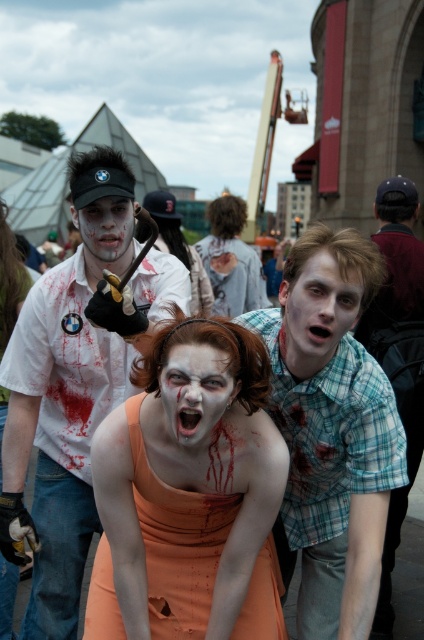
Question: Does matte white shirt at center have a larger size compared to blood-stained shirt at center?

Choices:
 (A) yes
 (B) no

Answer: (B)

Question: Among these objects, which one is nearest to the camera?

Choices:
 (A) pale matte face at center
 (B) blue plaid shirt at center

Answer: (A)

Question: Which object appears closest to the camera in this image?

Choices:
 (A) matte skin face at center
 (B) pale matte face at center
 (C) orange fabric dress at center
 (D) blood-stained shirt at center

Answer: (C)

Question: Is matte skin face at center thinner than pale matte face at center?

Choices:
 (A) no
 (B) yes

Answer: (B)

Question: Where is matte white shirt at center located in relation to blue plaid shirt at center in the image?

Choices:
 (A) above
 (B) below

Answer: (B)

Question: Which object appears closest to the camera in this image?

Choices:
 (A) matte white face at center
 (B) checkered fabric shirt at center

Answer: (B)